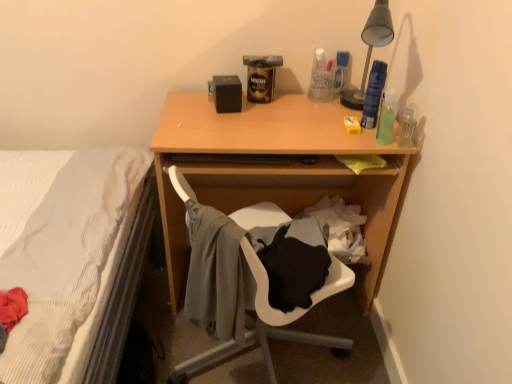
Where is `vacant area on top of wooden desk at center (from a real-world perspective)`? Image resolution: width=512 pixels, height=384 pixels. vacant area on top of wooden desk at center (from a real-world perspective) is located at coordinates (304, 111).